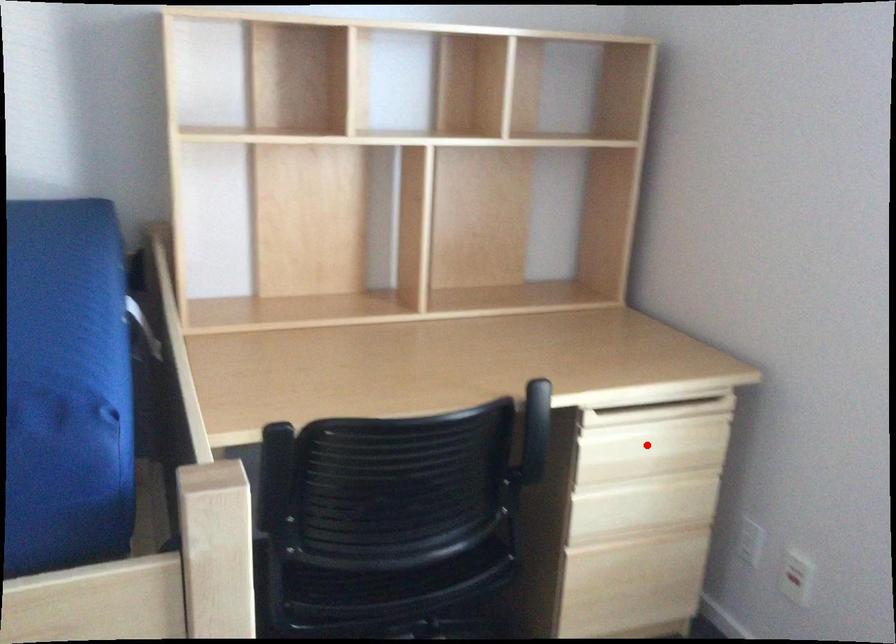
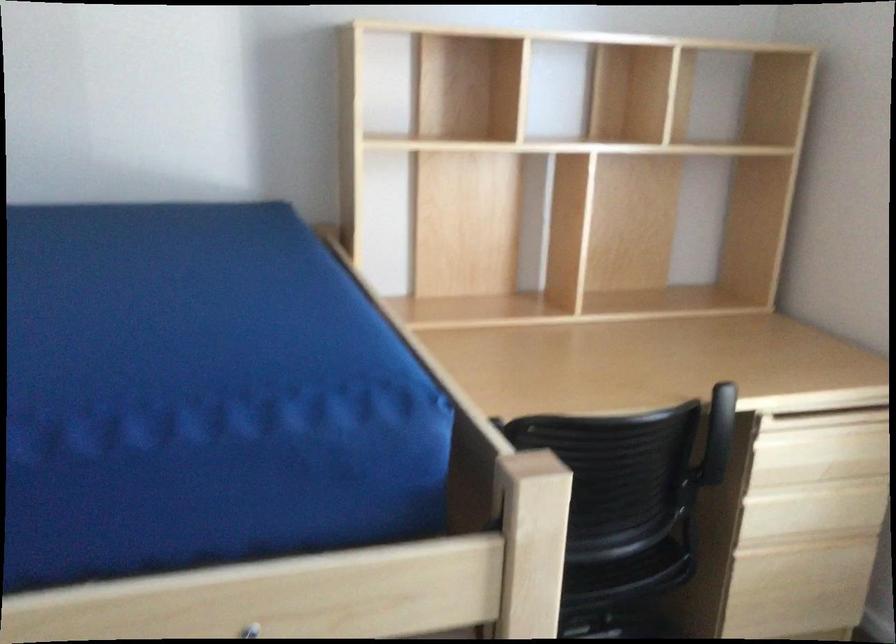
The point at the highlighted location is marked in the first image. Where is the corresponding point in the second image?

(819, 450)